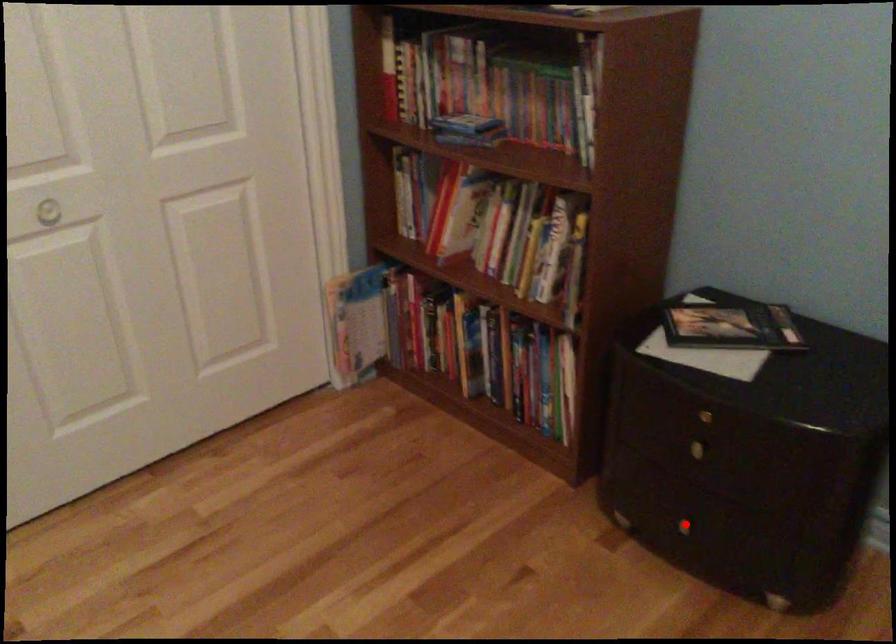
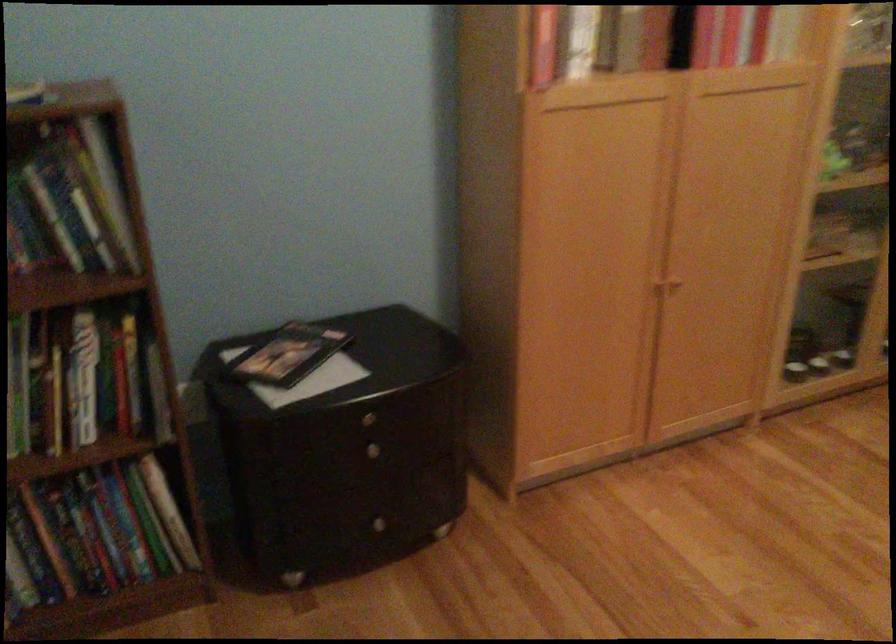
Locate, in the second image, the point that corresponds to the highlighted location in the first image.

(380, 524)